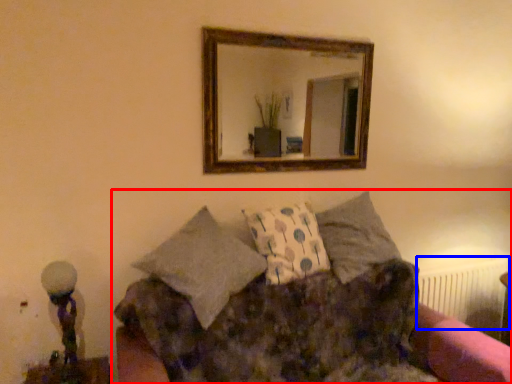
Question: Which object appears closest to the camera in this image, studio couch (highlighted by a red box) or radiator (highlighted by a blue box)?

Choices:
 (A) studio couch
 (B) radiator

Answer: (A)